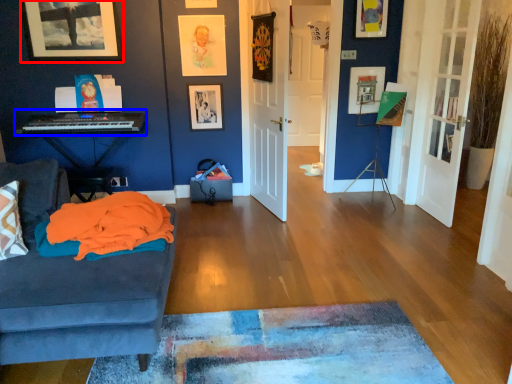
Question: Among these objects, which one is farthest to the camera, picture frame (highlighted by a red box) or musical keyboard (highlighted by a blue box)?

Choices:
 (A) picture frame
 (B) musical keyboard

Answer: (A)